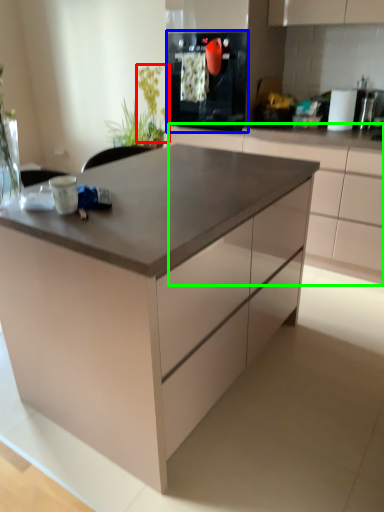
Question: Which is farther away from plant (highlighted by a red box)? kitchen appliance (highlighted by a blue box) or cabinetry (highlighted by a green box)?

Choices:
 (A) kitchen appliance
 (B) cabinetry

Answer: (B)